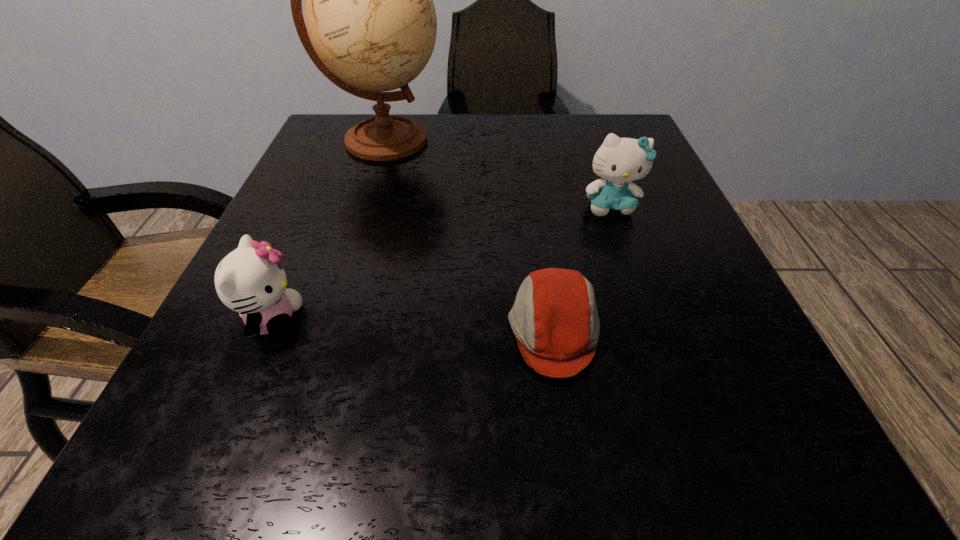
Locate an element on the screen. Image resolution: width=960 pixels, height=540 pixels. globe is located at coordinates (x=371, y=25).

You are a GUI agent. You are given a task and a screenshot of the screen. Output one action in this format:
    pyautogui.click(x=<x>, y=<y>)
    Task: Click on the tallest object
    
    Given the screenshot: What is the action you would take?
    click(371, 25)

You are a GUI agent. You are given a task and a screenshot of the screen. Output one action in this format:
    pyautogui.click(x=<x>, y=<y>)
    Task: Click on the farther kitten
    The height and width of the screenshot is (540, 960).
    Given the screenshot: What is the action you would take?
    pyautogui.click(x=619, y=161)

I want to click on the third nearest object, so click(x=619, y=161).

This screenshot has height=540, width=960. I want to click on the nearer kitten, so click(x=250, y=280).

This screenshot has width=960, height=540. In order to click on the second object from right to left in this screenshot , I will do click(x=555, y=320).

Identify the location of the shortest object. Image resolution: width=960 pixels, height=540 pixels. (555, 320).

The image size is (960, 540). What are the coordinates of `vacant space situated 0.070m on the surface of the farthest object` in the screenshot? It's located at (475, 140).

I want to click on free region located on the face of the third nearest object, so click(x=638, y=285).

The image size is (960, 540). I want to click on blank area located 0.050m on the front-facing side of the nearer kitten, so tap(337, 320).